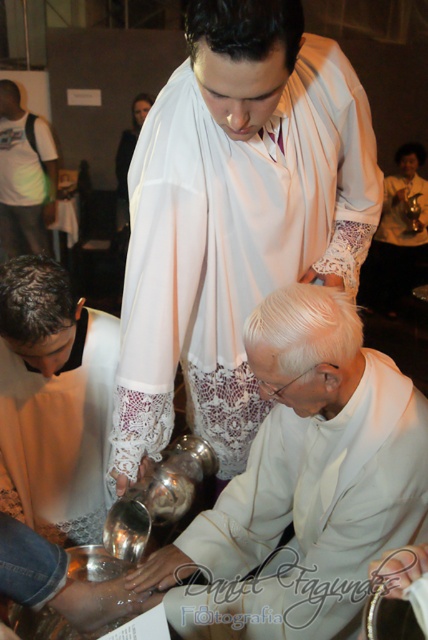
You are a photographer at the back of the room during the ceremony. You want to capture a closeup of the white lace cloth at center. Which direction should you move to get closer to it?

The white lace cloth at center is located at point 0.339 on the x axis and 0.549 on the y axis. To get closer, move towards the center of the room where the white lace cloth at center is positioned.

From the picture: You are attending a religious ceremony and need to place a small offering on the white lace cloth at center. Given that the cloth is located at point (x=234, y=216), can you confirm the exact coordinates where the cloth is situated?

The white lace cloth at center is located exactly at point (x=234, y=216).